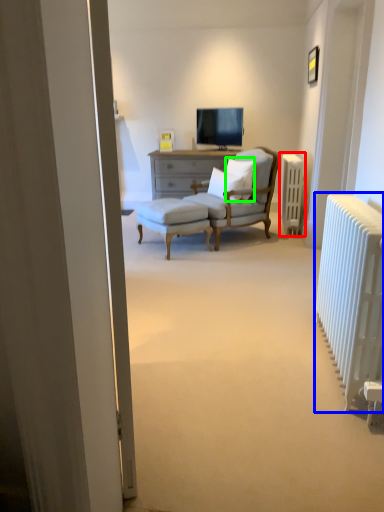
Question: Considering the real-world distances, which object is closest to radiator (highlighted by a red box)? radiator (highlighted by a blue box) or pillow (highlighted by a green box).

Choices:
 (A) radiator
 (B) pillow

Answer: (B)